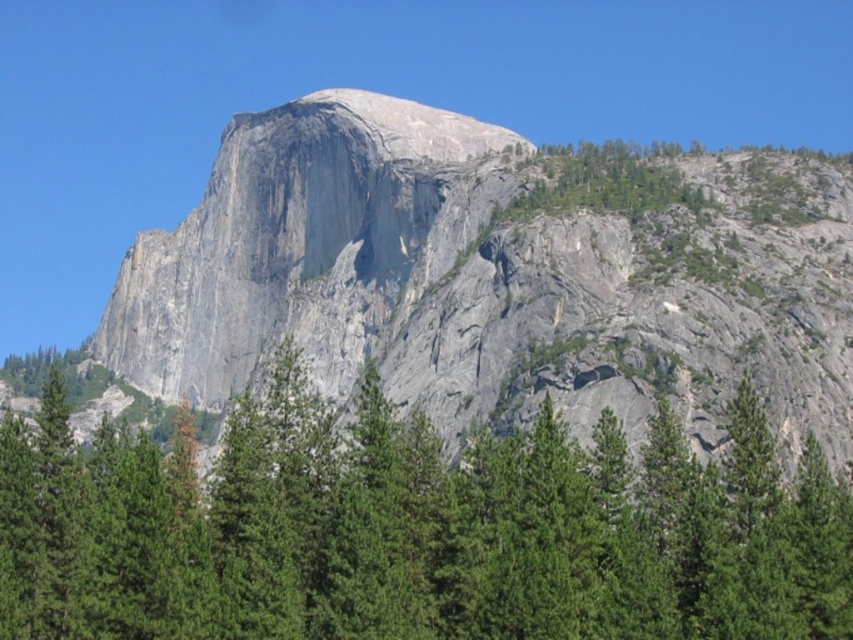
Question: Which point appears closest to the camera in this image?

Choices:
 (A) (152, 390)
 (B) (674, 148)

Answer: (B)

Question: Does gray rock mountain at center come behind green leafy trees at upper right?

Choices:
 (A) yes
 (B) no

Answer: (B)

Question: From the image, what is the correct spatial relationship of gray rock mountain at center in relation to green textured pine tree at center?

Choices:
 (A) above
 (B) below

Answer: (A)

Question: Which object appears closest to the camera in this image?

Choices:
 (A) green textured pine tree at center
 (B) green leafy trees at upper right
 (C) gray rock mountain at center

Answer: (A)

Question: Which point is farther to the camera?

Choices:
 (A) green textured pine tree at center
 (B) gray rock mountain at center
 (C) green leafy trees at upper right

Answer: (C)

Question: Is gray rock mountain at center wider than green leafy trees at upper right?

Choices:
 (A) no
 (B) yes

Answer: (B)